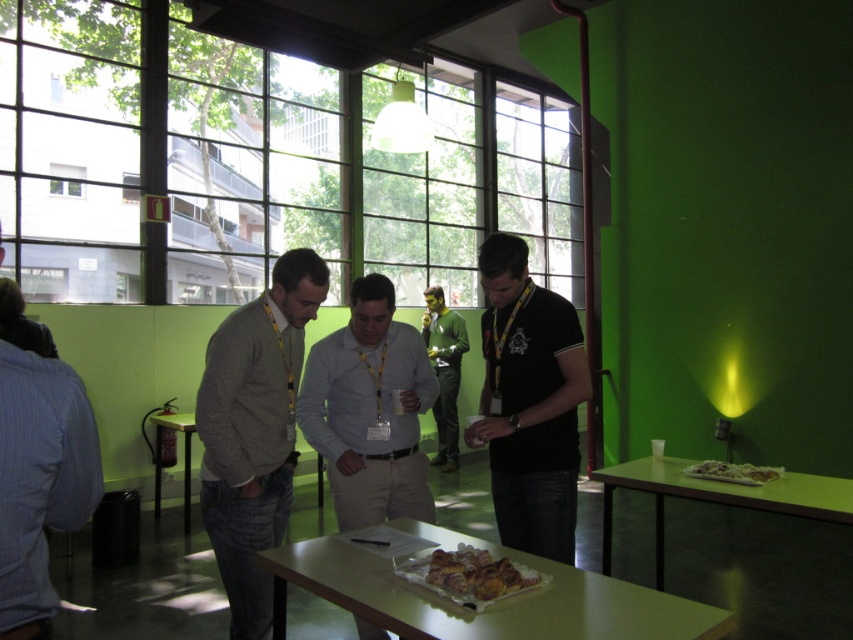
Who is taller, light green glossy table at lower center or light gray shirt at center?

light gray shirt at center is taller.

Is light green glossy table at lower center to the right of light gray shirt at center from the viewer's perspective?

Correct, you'll find light green glossy table at lower center to the right of light gray shirt at center.

Who is more distant from viewer, (x=379, y=547) or (x=335, y=445)?

The point (x=335, y=445) is behind.

At what (x,y) coordinates should I click in order to perform the action: click on light green glossy table at lower center. Please return your answer as a coordinate pair (x, y). Image resolution: width=853 pixels, height=640 pixels. Looking at the image, I should click on tap(486, 608).

Find the location of a particular element. The width and height of the screenshot is (853, 640). transparent glass window at upper center is located at coordinates (254, 164).

This screenshot has height=640, width=853. What do you see at coordinates (254, 164) in the screenshot? I see `transparent glass window at upper center` at bounding box center [254, 164].

I want to click on transparent glass window at upper center, so click(254, 164).

Can you confirm if gray sweater at center is positioned below golden brown croissant at center?

Incorrect, gray sweater at center is not positioned below golden brown croissant at center.

Is gray sweater at center above golden brown croissant at center?

Correct, gray sweater at center is located above golden brown croissant at center.

Identify the location of gray sweater at center. This screenshot has height=640, width=853. (254, 432).